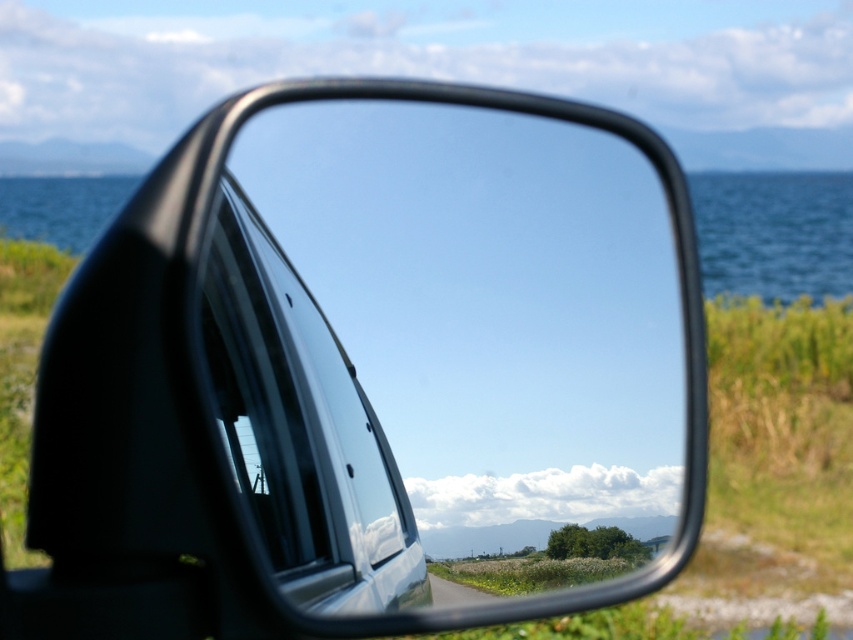
You are driving a car and want to check the road behind you. You see the black glossy mirror at center and the transparent glass car window at center. Which object should you use to see the road behind your car?

You should use the black glossy mirror at center because it is designed to reflect the road behind the car, while the transparent glass car window at center is meant for viewing the front or sides and cannot show the rear view effectively.

You are a photographer trying to capture the reflection in the black glossy mirror at center. Based on the scene description, where should you position your camera to ensure the mirror reflects the coastal landscape properly?

The black glossy mirror at center is located at point [370,372] in the image. To capture its reflection properly, position the camera directly in front of this point to align with the mirror surface and ensure the coastal landscape is visible in the reflection.

You are standing 1.08 meters away from the point at coordinates point (271,394). If you want to take a photo of this point using a camera with a 50mm lens, which has a field of view of 46 degrees, will the entire point be visible in the photo?

The point at coordinates point (271,394) is 1.08 meters away from the viewer. With a 50mm lens having a 46 degree field of view, the horizontal field of view covers approximately 0.83 meters at that distance. Since the point is a single point, it will definitely be visible within the 0.83 meter width, so yes, the entire point will be visible in the photo.